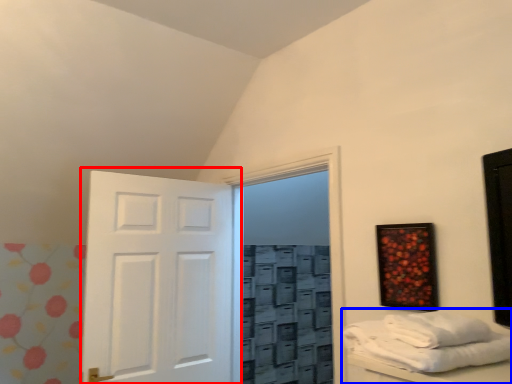
Question: Which of the following is the farthest to the observer, door (highlighted by a red box) or furniture (highlighted by a blue box)?

Choices:
 (A) door
 (B) furniture

Answer: (A)